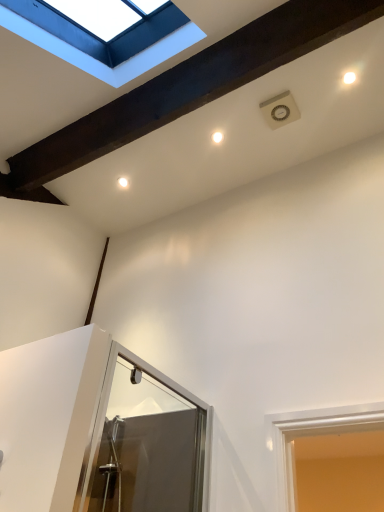
Question: Is white painted wood window at upper left in front of or behind white glossy droplight at upper center in the image?

Choices:
 (A) behind
 (B) front

Answer: (B)

Question: From a real-world perspective, is white painted wood window at upper left positioned above or below white glossy droplight at upper center?

Choices:
 (A) above
 (B) below

Answer: (B)

Question: In terms of height, does white painted wood window at upper left look taller or shorter compared to white glossy droplight at upper center?

Choices:
 (A) tall
 (B) short

Answer: (A)

Question: Based on their sizes in the image, would you say white glossy droplight at upper center is bigger or smaller than white painted wood window at upper left?

Choices:
 (A) big
 (B) small

Answer: (B)

Question: Is point (213, 138) positioned closer to the camera than point (59, 45)?

Choices:
 (A) closer
 (B) farther

Answer: (B)

Question: Looking at their shapes, would you say white glossy droplight at upper center is wider or thinner than white painted wood window at upper left?

Choices:
 (A) thin
 (B) wide

Answer: (A)

Question: From a real-world perspective, is white glossy droplight at upper center above or below white painted wood window at upper left?

Choices:
 (A) below
 (B) above

Answer: (B)